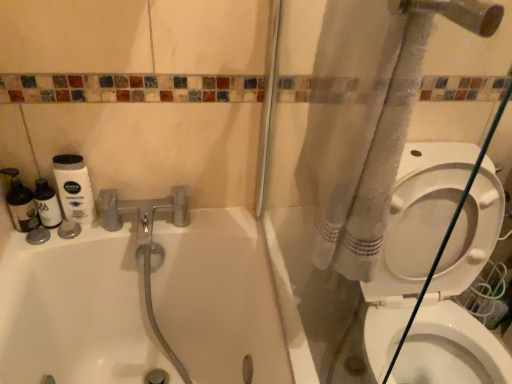
Image resolution: width=512 pixels, height=384 pixels. What do you see at coordinates (144, 303) in the screenshot?
I see `white glossy bathtub at upper left` at bounding box center [144, 303].

This screenshot has height=384, width=512. Identify the location of white glossy bidet at lower right. (450, 350).

The height and width of the screenshot is (384, 512). What do you see at coordinates (318, 190) in the screenshot? I see `white fabric shower curtain at right` at bounding box center [318, 190].

Locate an element on the screen. This screenshot has width=512, height=384. white fabric shower curtain at right is located at coordinates (318, 190).

Locate an element on the screen. The width and height of the screenshot is (512, 384). white glossy bathtub at upper left is located at coordinates (144, 303).

Which of these two, white fabric shower curtain at right or white glossy bidet at lower right, is bigger?

Bigger between the two is white fabric shower curtain at right.

Is white fabric shower curtain at right not inside white glossy bidet at lower right?

Yes, white fabric shower curtain at right is located beyond the bounds of white glossy bidet at lower right.

From the image's perspective, is white fabric shower curtain at right located beneath white glossy bidet at lower right?

Incorrect, from the image's perspective, white fabric shower curtain at right is higher than white glossy bidet at lower right.

Is white glossy bidet at lower right turned away from white fabric shower curtain at right?

Yes, white fabric shower curtain at right is at the back of white glossy bidet at lower right.

Between white glossy bidet at lower right and white fabric shower curtain at right, which one has more height?

Standing taller between the two is white fabric shower curtain at right.

Considering their positions, is white glossy bidet at lower right located in front of or behind white fabric shower curtain at right?

white glossy bidet at lower right is positioned farther from the viewer than white fabric shower curtain at right.

Consider the image. From the image's perspective, is white glossy bidet at lower right positioned above or below white fabric shower curtain at right?

Based on their image positions, white glossy bidet at lower right is located beneath white fabric shower curtain at right.

From a real-world perspective, is white glossy bidet at lower right physically above white glossy bathtub at upper left?

No.

Measure the distance between white glossy bidet at lower right and white glossy bathtub at upper left.

white glossy bidet at lower right and white glossy bathtub at upper left are 22.94 inches apart.

Based on the photo, which of these two, white glossy bidet at lower right or white glossy bathtub at upper left, is bigger?

white glossy bathtub at upper left.

In terms of height, does white glossy bidet at lower right look taller or shorter compared to white glossy bathtub at upper left?

Considering their sizes, white glossy bidet at lower right has less height than white glossy bathtub at upper left.

How many degrees apart are the facing directions of white glossy bathtub at upper left and white glossy bidet at lower right?

1.22 degrees separate the facing orientations of white glossy bathtub at upper left and white glossy bidet at lower right.

Is white glossy bathtub at upper left beside white glossy bidet at lower right?

No, white glossy bathtub at upper left is not in contact with white glossy bidet at lower right.

Between white glossy bathtub at upper left and white glossy bidet at lower right, which one has larger size?

Bigger between the two is white glossy bathtub at upper left.

Considering the positions of objects white glossy bathtub at upper left and white glossy bidet at lower right in the image provided, who is in front, white glossy bathtub at upper left or white glossy bidet at lower right?

white glossy bathtub at upper left is closer to the camera.

Is white glossy bathtub at upper left at the back of white fabric shower curtain at right?

No, white fabric shower curtain at right's orientation is not away from white glossy bathtub at upper left.

Is white glossy bathtub at upper left inside white fabric shower curtain at right?

No.

Which is in front, white fabric shower curtain at right or white glossy bathtub at upper left?

white glossy bathtub at upper left is closer to the camera.

Which of these two, white fabric shower curtain at right or white glossy bathtub at upper left, stands shorter?

white glossy bathtub at upper left is shorter.

Considering the sizes of objects white glossy bathtub at upper left and white fabric shower curtain at right in the image provided, who is bigger, white glossy bathtub at upper left or white fabric shower curtain at right?

white glossy bathtub at upper left.

How distant is white glossy bathtub at upper left from white fabric shower curtain at right?

white glossy bathtub at upper left is 14.42 inches from white fabric shower curtain at right.

Is white glossy bathtub at upper left located outside white fabric shower curtain at right?

Absolutely, white glossy bathtub at upper left is external to white fabric shower curtain at right.

From the image's perspective, does white glossy bathtub at upper left appear higher than white fabric shower curtain at right?

Incorrect, from the image's perspective, white glossy bathtub at upper left is lower than white fabric shower curtain at right.

Where is `bidet beneath the white fabric shower curtain at right (from a real-world perspective)`? bidet beneath the white fabric shower curtain at right (from a real-world perspective) is located at coordinates (450, 350).

The height and width of the screenshot is (384, 512). I want to click on shower door in front of the white glossy bidet at lower right, so point(318,190).

Which object lies nearer to the anchor point white fabric shower curtain at right, white glossy bathtub at upper left or white glossy bidet at lower right?

white glossy bathtub at upper left is positioned closer to the anchor white fabric shower curtain at right.

Looking at the image, which one is located closer to white glossy bidet at lower right, white glossy bathtub at upper left or white fabric shower curtain at right?

white fabric shower curtain at right is closer to white glossy bidet at lower right.

Estimate the real-world distances between objects in this image. Which object is closer to white glossy bathtub at upper left, white fabric shower curtain at right or white glossy bidet at lower right?

white fabric shower curtain at right lies closer to white glossy bathtub at upper left than the other object.

Estimate the real-world distances between objects in this image. Which object is further from white fabric shower curtain at right, white glossy bidet at lower right or white glossy bathtub at upper left?

white glossy bidet at lower right.

Considering their positions, is white fabric shower curtain at right positioned closer to white glossy bidet at lower right than white glossy bathtub at upper left?

white fabric shower curtain at right is positioned closer to the anchor white glossy bidet at lower right.

Considering their positions, is white glossy bidet at lower right positioned closer to white glossy bathtub at upper left than white fabric shower curtain at right?

The object closer to white glossy bathtub at upper left is white fabric shower curtain at right.

You are a GUI agent. You are given a task and a screenshot of the screen. Output one action in this format:
    pyautogui.click(x=<x>, y=<y>)
    Task: Click on the shower door between white glossy bathtub at upper left and white glossy bidet at lower right in the horizontal direction
    Image resolution: width=512 pixels, height=384 pixels.
    Given the screenshot: What is the action you would take?
    point(318,190)